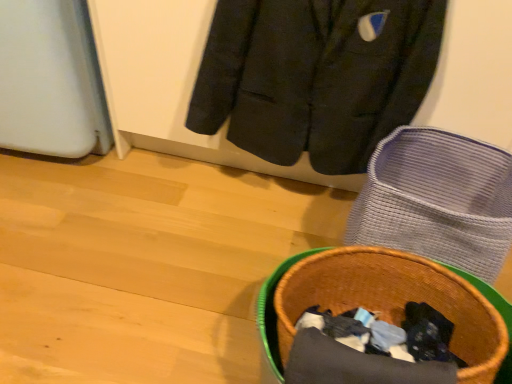
The width and height of the screenshot is (512, 384). What are the coordinates of `free spot below dark gray wool jacket at upper center (from a real-world perspective)` in the screenshot? It's located at (280, 203).